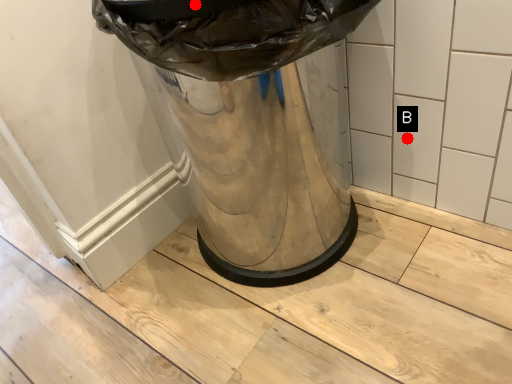
Question: Two points are circled on the image, labeled by A and B beside each circle. Among these points, which one is nearest to the camera?

Choices:
 (A) A is closer
 (B) B is closer

Answer: (A)